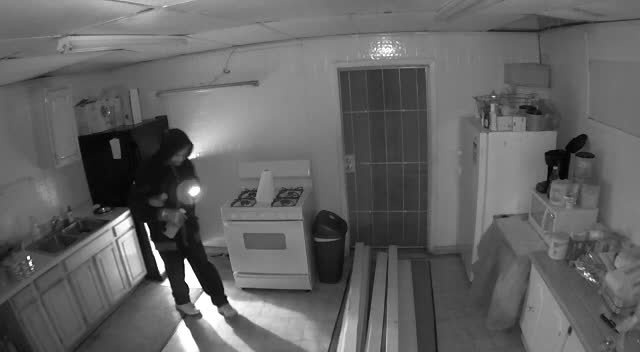
This screenshot has height=352, width=640. I want to click on door, so click(381, 163).